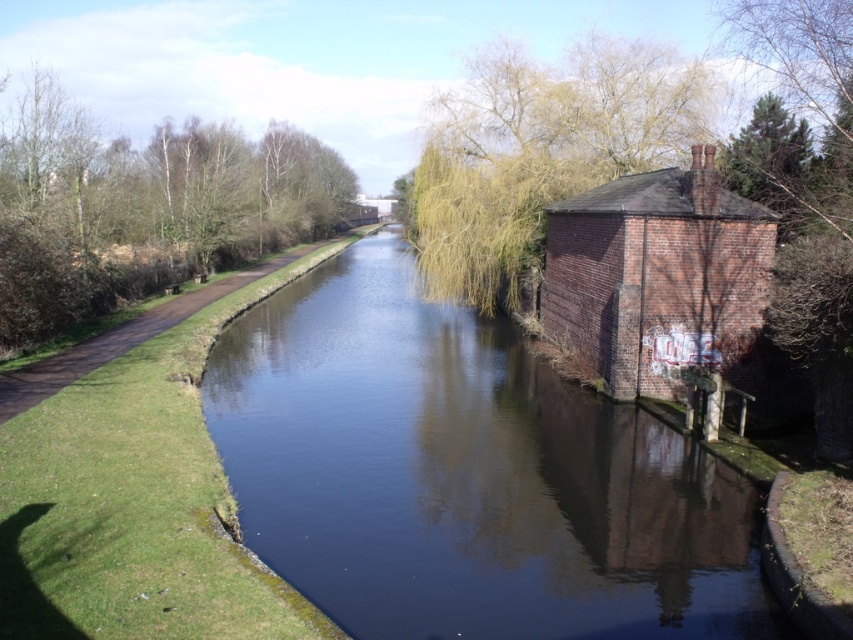
You are a photographer aiming to capture the brown leafy tree at upper left and the dark blue water at center in your shot. Based on their positions, which object is located to the right of the other?

The dark blue water at center is positioned on the right side of brown leafy tree at upper left, so the dark blue water at center is to the right of the brown leafy tree at upper left.